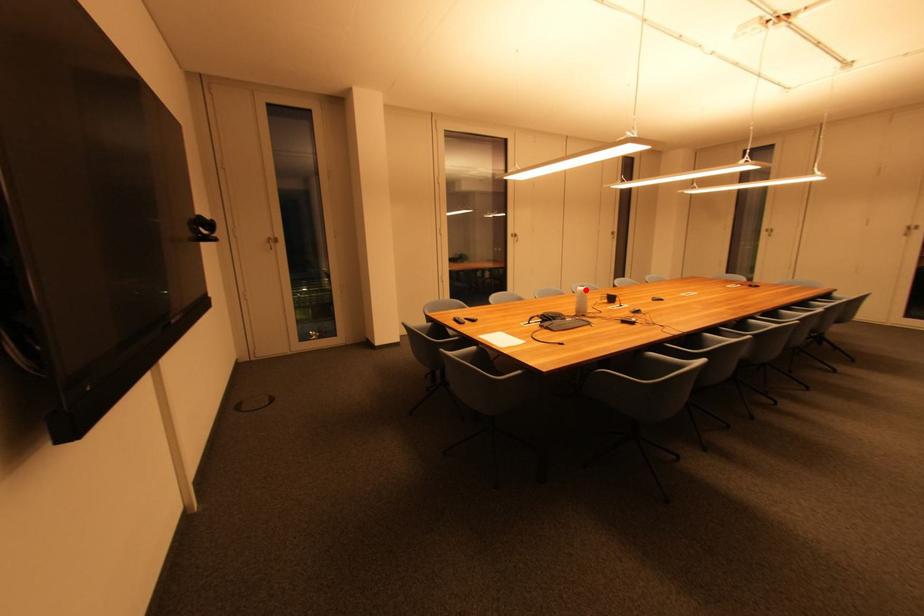
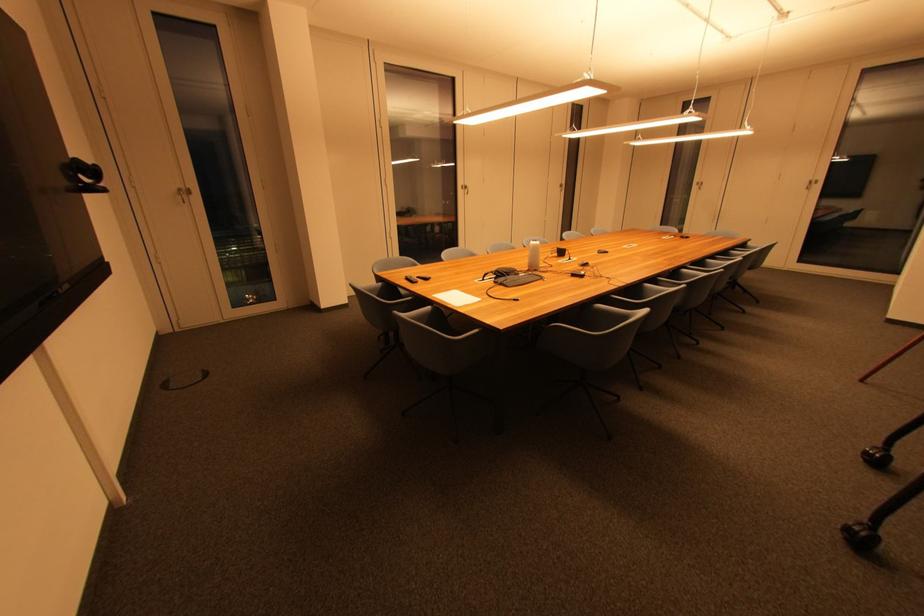
In the second image, find the point that corresponds to the highlighted location in the first image.

(538, 244)